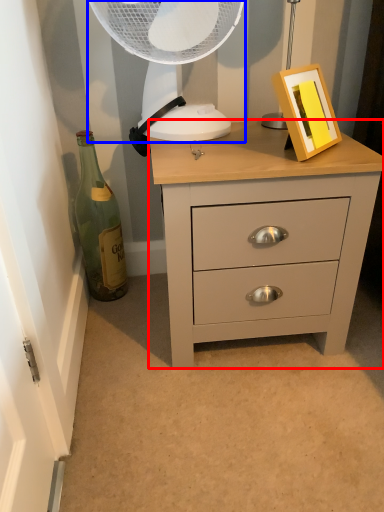
Question: Which object appears farthest to the camera in this image, chest of drawers (highlighted by a red box) or mechanical fan (highlighted by a blue box)?

Choices:
 (A) chest of drawers
 (B) mechanical fan

Answer: (B)